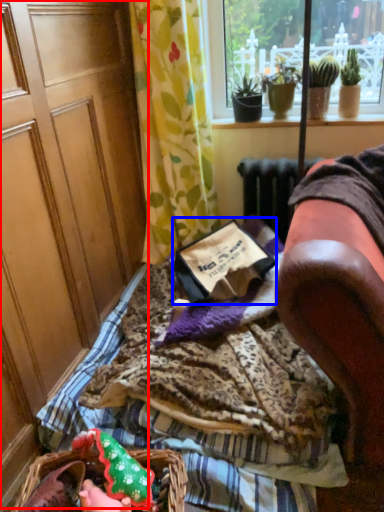
Question: Among these objects, which one is farthest to the camera, screen door (highlighted by a red box) or paperback book (highlighted by a blue box)?

Choices:
 (A) screen door
 (B) paperback book

Answer: (B)